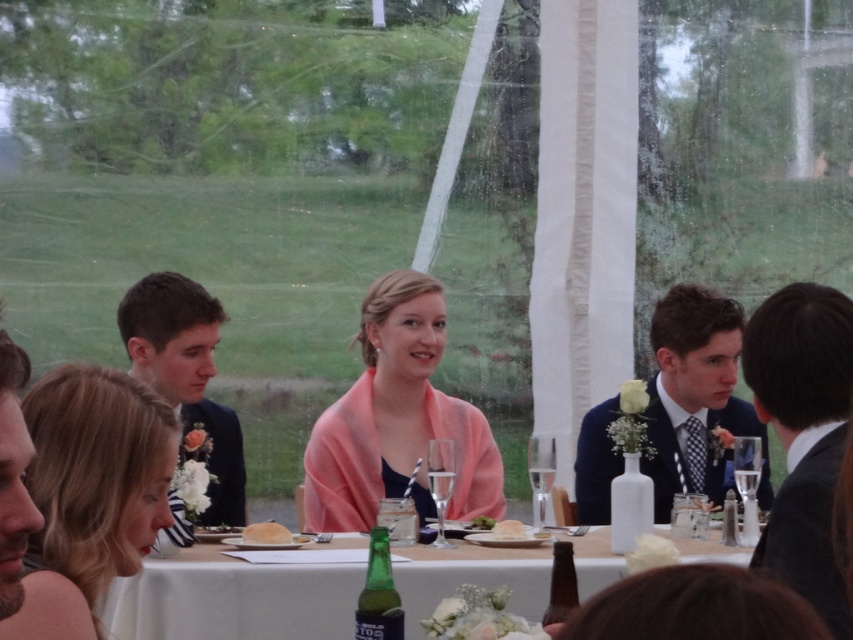
Question: Among these points, which one is farthest from the camera?

Choices:
 (A) (221, 456)
 (B) (544, 577)

Answer: (A)

Question: Which of these objects is positioned farthest from the white fluffy cake at center?

Choices:
 (A) pink fabric at center
 (B) white bread at center

Answer: (B)

Question: In this image, where is dark blue suit at left located relative to smooth brown hair at lower left?

Choices:
 (A) above
 (B) below

Answer: (B)

Question: Can you confirm if blonde hair at center is bigger than white fabric table at center?

Choices:
 (A) no
 (B) yes

Answer: (A)

Question: Which point is farther to the camera?

Choices:
 (A) (123, 547)
 (B) (424, 323)
 (C) (608, 484)
 (D) (496, 536)

Answer: (B)

Question: Can you confirm if white fabric table at center is wider than smooth brown hair at lower left?

Choices:
 (A) no
 (B) yes

Answer: (B)